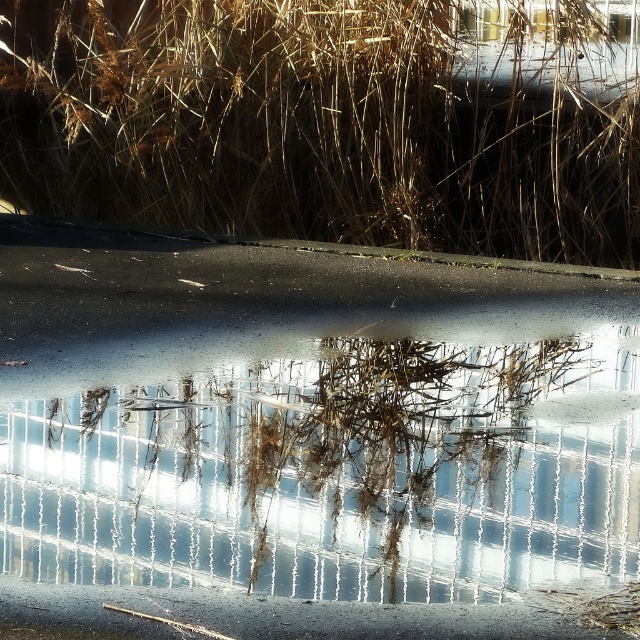
You are a photographer wanting to capture the reflection of the brown grass at upper center in the clear glass puddle at center. Since the puddle is larger than the grass, will the entire grass be reflected in the puddle?

The clear glass puddle at center is larger in size than brown grass at upper center, so yes, the entire brown grass at upper center will be reflected in the puddle.